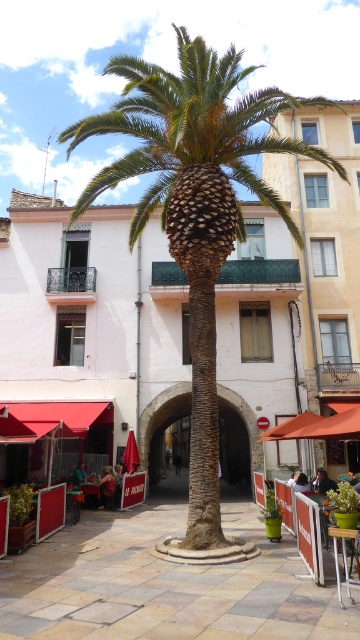
You are planning to place a new bench that is 2 meters long in the square. Given the space between the smooth white building at center and the wooden table at center, will the bench fit there?

The smooth white building at center is wider than the wooden table at center, but the exact distance between them isn

You are a city planner assessing the space around the palm tree in the square. You need to determine if there is enough room to place a new bench that is the same size as the wooden table at center. Based on the scene, can you confirm if the smooth white building at center would block the placement of the bench?

The smooth white building at center is larger in size than the wooden table at center. Since the bench would be the same size as the wooden table at center, the building might not block the bench placement, but the exact space availability depends on the distance between them, which isn

You are standing at the entrance of the square, which is located at point coordinates of 0.0, 0.0. You want to walk directly towards the smooth white building at center. What direction should you head in?

Since the smooth white building at center is located at point coordinates of (91, 326), you should head northeast to reach it.